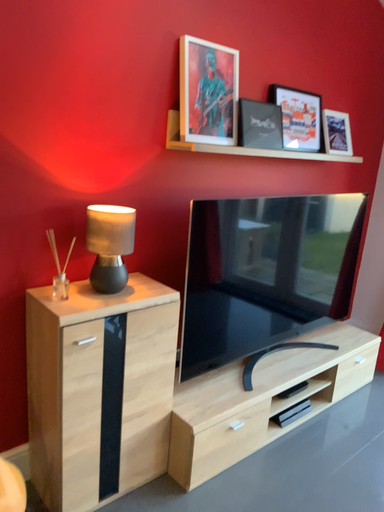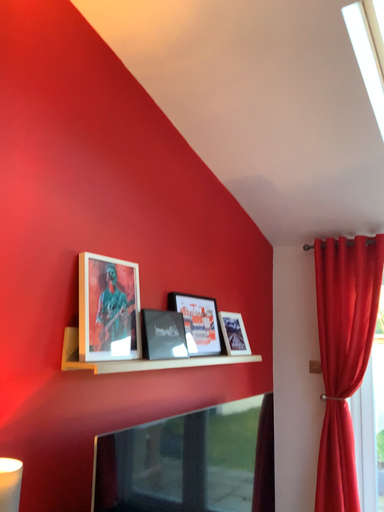
Question: How did the camera likely rotate when shooting the video?

Choices:
 (A) rotated upward
 (B) rotated downward

Answer: (A)